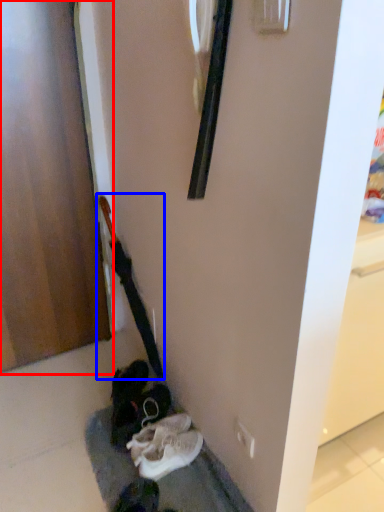
Question: Which point is further to the camera, door (highlighted by a red box) or guitar (highlighted by a blue box)?

Choices:
 (A) door
 (B) guitar

Answer: (B)